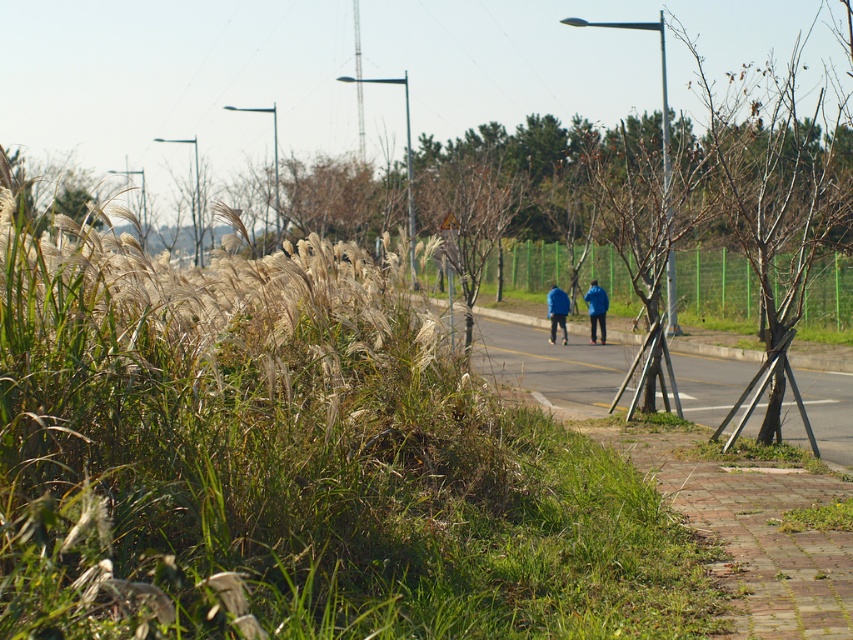
Is point (691, 406) closer to camera compared to point (549, 337)?

Yes, point (691, 406) is closer to viewer.

Which is in front, point (728, 384) or point (550, 291)?

Point (728, 384) is more forward.

This screenshot has width=853, height=640. I want to click on green grass at center, so click(548, 360).

Can you confirm if blue fabric jackets at center is taller than blue fabric jacket at center?

Indeed, blue fabric jackets at center has a greater height compared to blue fabric jacket at center.

Between blue fabric jackets at center and blue fabric jacket at center, which one appears on the right side from the viewer's perspective?

blue fabric jackets at center is more to the right.

Where is `blue fabric jackets at center`? Image resolution: width=853 pixels, height=640 pixels. blue fabric jackets at center is located at coordinates (596, 308).

Which is behind, point (728, 400) or point (602, 294)?

The point (602, 294) is behind.

Who is positioned more to the right, green grass at center or blue matte jacket at center?

blue matte jacket at center

Does point (582, 372) come in front of point (589, 307)?

That is True.

You are a GUI agent. You are given a task and a screenshot of the screen. Output one action in this format:
    pyautogui.click(x=<x>, y=<y>)
    Task: Click on the green grass at center
    
    Given the screenshot: What is the action you would take?
    pyautogui.click(x=548, y=360)